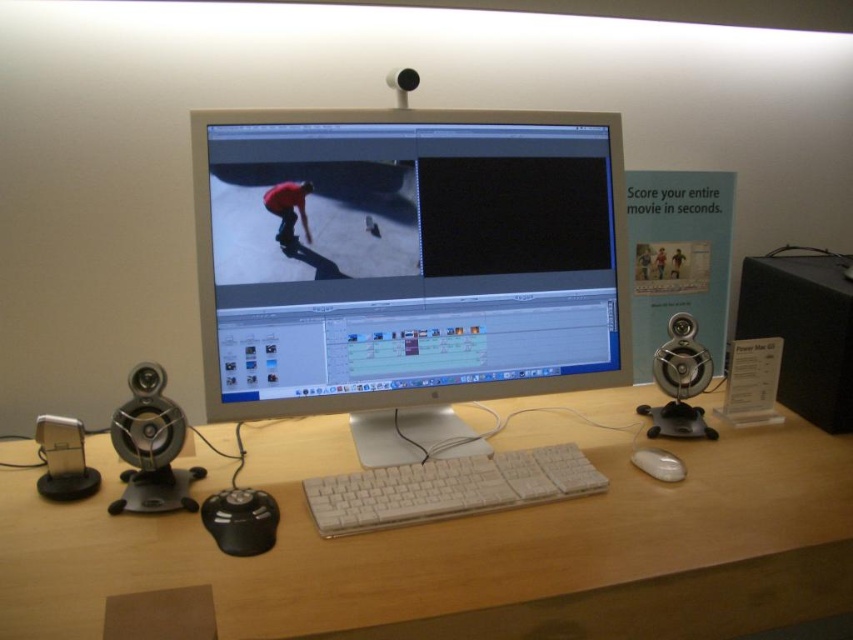
Which is more to the left, white wood computer desk at center or white plastic keyboard at center?

white wood computer desk at center

I want to click on white wood computer desk at center, so click(468, 547).

You are a GUI agent. You are given a task and a screenshot of the screen. Output one action in this format:
    pyautogui.click(x=<x>, y=<y>)
    Task: Click on the white wood computer desk at center
    This screenshot has height=640, width=853.
    Given the screenshot: What is the action you would take?
    pyautogui.click(x=468, y=547)

Does black matte speaker at right have a larger size compared to white matte mouse at lower center?

Yes, black matte speaker at right is bigger than white matte mouse at lower center.

Is point (837, 321) closer to camera compared to point (677, 472)?

No, it is behind (677, 472).

Is point (795, 292) behind point (654, 468)?

Yes, point (795, 292) is behind point (654, 468).

Where is `black matte speaker at right`? black matte speaker at right is located at coordinates (804, 330).

Which of these two, white wood computer desk at center or white plastic monitor at center, stands taller?

Standing taller between the two is white plastic monitor at center.

This screenshot has width=853, height=640. I want to click on white wood computer desk at center, so 468,547.